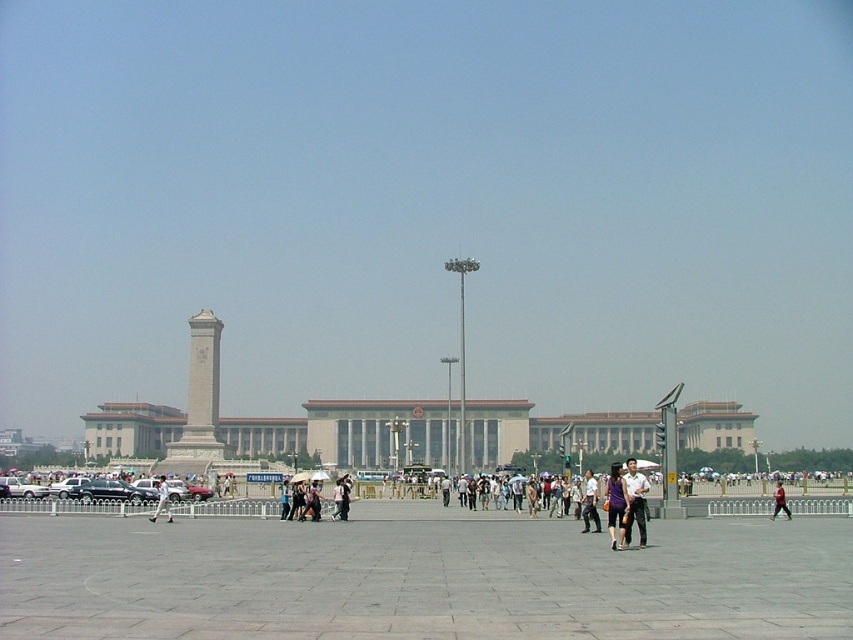
You are standing at the center of the plaza and see the dark purple shirt at center. Can you confirm if the dark purple shirt at center is located exactly at the point with coordinates (590, 502)?

Yes, the point (590, 502) indicates dark purple shirt at center.